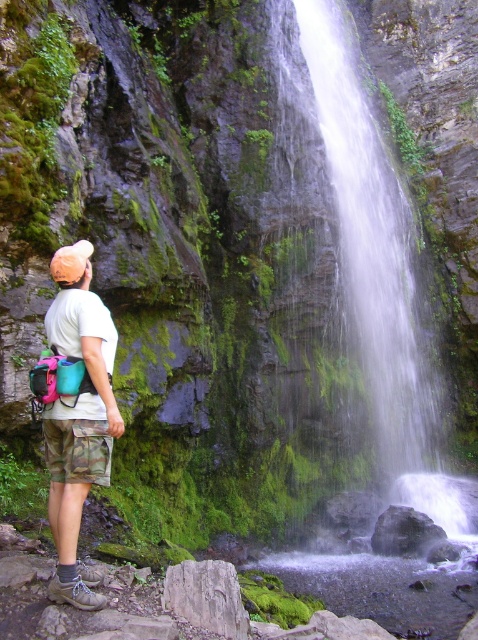
What do you see at coordinates (369, 252) in the screenshot?
I see `green mossy waterfall at center` at bounding box center [369, 252].

Does green mossy waterfall at center appear over camo shorts at lower left?

Correct, green mossy waterfall at center is located above camo shorts at lower left.

Which is in front, point (335, 108) or point (47, 465)?

Point (47, 465) is in front.

Where is `green mossy waterfall at center`? green mossy waterfall at center is located at coordinates (369, 252).